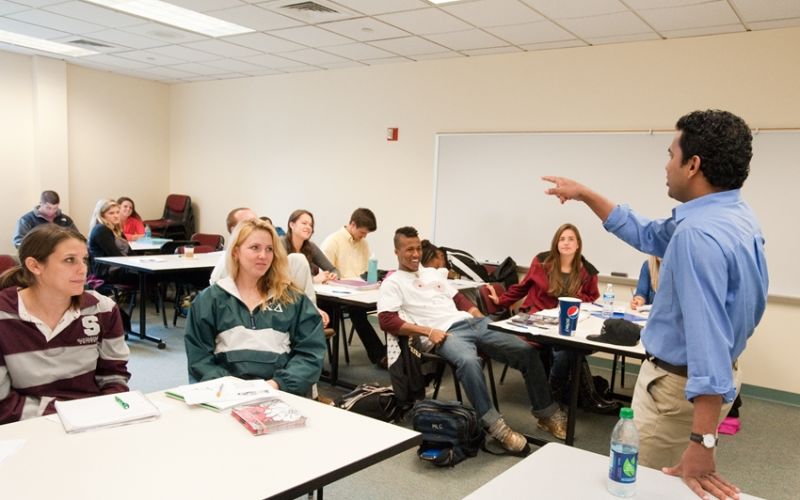
Locate an element on the screen. Image resolution: width=800 pixels, height=500 pixels. chairs is located at coordinates (485, 292), (174, 200), (177, 231), (202, 242), (6, 266).